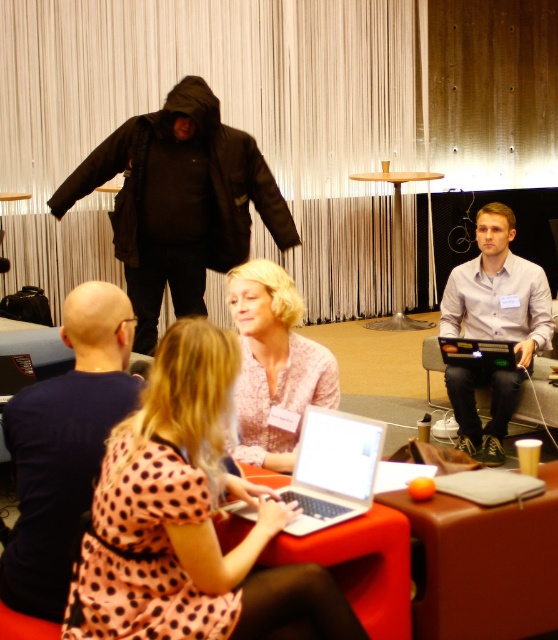
Question: Is orange leather table at lower center positioned in front of wooden table at center?

Choices:
 (A) yes
 (B) no

Answer: (A)

Question: Which object is the closest to the silver metallic laptop at center?

Choices:
 (A) black matte jacket at upper left
 (B) metallic silver laptop at center
 (C) pink dotted dress at center
 (D) dark blue shirt at center

Answer: (B)

Question: Is orange leather table at lower center above white shirt at center?

Choices:
 (A) yes
 (B) no

Answer: (B)

Question: Which point appears closest to the camera in this image?

Choices:
 (A) (501, 234)
 (B) (545, 602)
 (C) (421, 173)

Answer: (B)

Question: Is dark blue shirt at center thinner than wooden table at center?

Choices:
 (A) no
 (B) yes

Answer: (B)

Question: Among these objects, which one is farthest from the camera?

Choices:
 (A) metallic silver laptop at center
 (B) black matte jacket at upper left

Answer: (B)